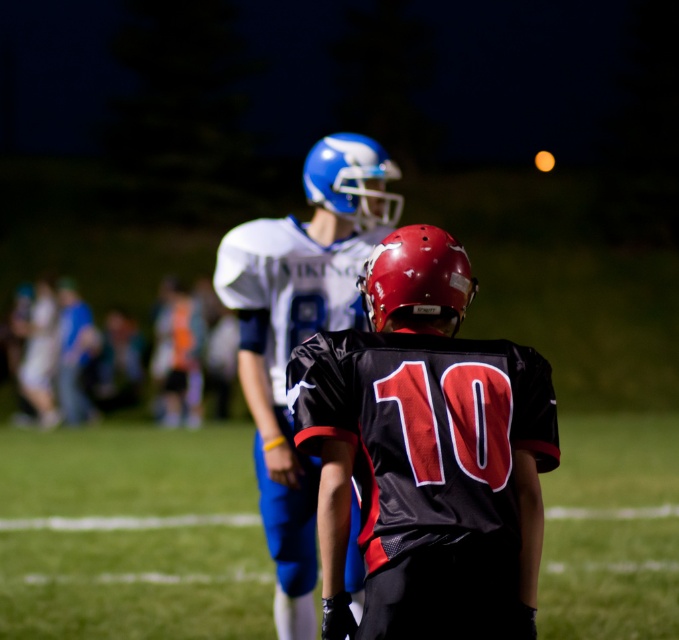
Question: Is green grass football field at center closer to the viewer compared to black mesh jersey at center?

Choices:
 (A) yes
 (B) no

Answer: (B)

Question: Among these points, which one is farthest from the camera?

Choices:
 (A) (31, 592)
 (B) (414, 237)
 (C) (240, 369)

Answer: (A)

Question: Among these objects, which one is farthest from the camera?

Choices:
 (A) shiny red helmet at center
 (B) black mesh jersey at center
 (C) green grass football field at center
 (D) white matte jersey at center

Answer: (C)

Question: Observing the image, what is the correct spatial positioning of green grass football field at center in reference to black mesh jersey at center?

Choices:
 (A) below
 (B) above

Answer: (A)

Question: Based on their relative distances, which object is farther from the white matte jersey at center?

Choices:
 (A) shiny blue helmet at center
 (B) black mesh jersey at center
 (C) green grass football field at center

Answer: (C)

Question: Does black mesh jersey at center appear under shiny blue helmet at center?

Choices:
 (A) no
 (B) yes

Answer: (B)